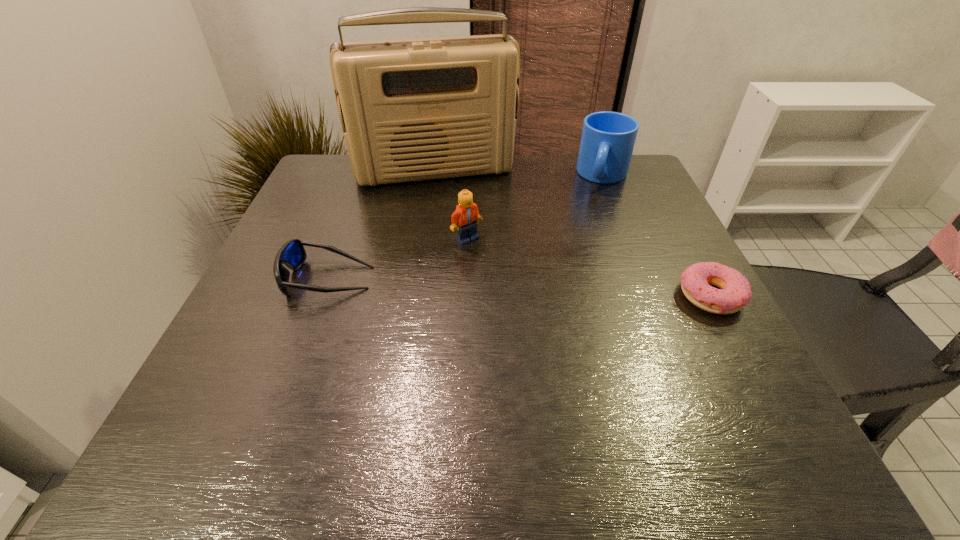
Where is `free spot between the radio receiver and the doughnut`? The height and width of the screenshot is (540, 960). free spot between the radio receiver and the doughnut is located at coordinates (573, 234).

This screenshot has height=540, width=960. In order to click on unoccupied area between the shortest object and the mug in this screenshot , I will do `click(657, 236)`.

At what (x,y) coordinates should I click in order to perform the action: click on vacant area between the tallest object and the mug. Please return your answer as a coordinate pair (x, y). This screenshot has width=960, height=540. Looking at the image, I should click on (519, 173).

Identify the location of vacant point located between the sunglasses and the third nearest object. This screenshot has height=540, width=960. (397, 259).

At what (x,y) coordinates should I click in order to perform the action: click on vacant area that lies between the tallest object and the mug. Please return your answer as a coordinate pair (x, y). Image resolution: width=960 pixels, height=540 pixels. Looking at the image, I should click on (519, 173).

The height and width of the screenshot is (540, 960). Identify the location of the third closest object to the mug. (735, 292).

Locate which object ranks third in proximity to the radio receiver. Please provide its 2D coordinates. Your answer should be formatted as a tuple, i.e. [(x, y)], where the tuple contains the x and y coordinates of a point satisfying the conditions above.

[(292, 254)]